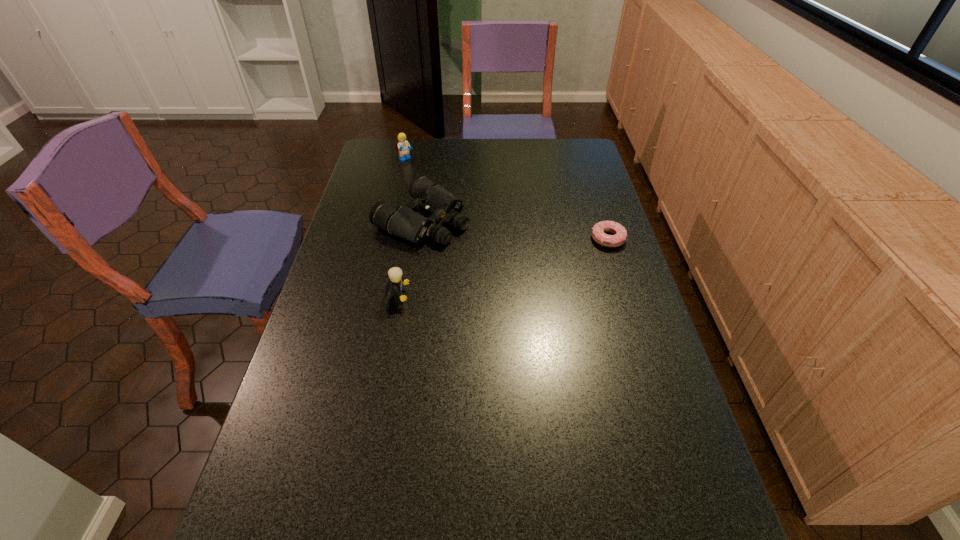
You are a GUI agent. You are given a task and a screenshot of the screen. Output one action in this format:
    pyautogui.click(x=<x>, y=<y>)
    Task: Click on the vacant space on the desktop that is between the right Lego and the shortest object and is positioned on the front-facing side of the farther Lego
    
    Given the screenshot: What is the action you would take?
    pyautogui.click(x=539, y=258)

The width and height of the screenshot is (960, 540). What are the coordinates of `vacant space on the desktop that is between the right Lego and the shortest object and is positioned through the eyepieces of the second shortest object` in the screenshot? It's located at (519, 264).